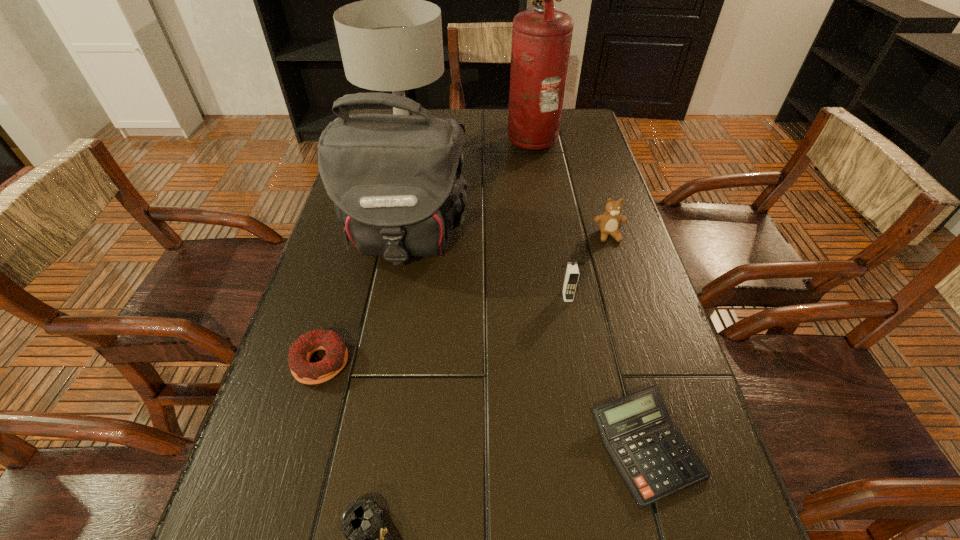
Find the location of a particular element. vacant space that's between the shoulder bag and the sixth farthest object is located at coordinates (363, 300).

Identify the location of free space between the shoulder bag and the fourth tallest object. (486, 267).

The width and height of the screenshot is (960, 540). I want to click on vacant space in between the calculator and the shoulder bag, so tap(524, 342).

You are a GUI agent. You are given a task and a screenshot of the screen. Output one action in this format:
    pyautogui.click(x=<x>, y=<y>)
    Task: Click on the free space between the lampshade and the calculator
    The width and height of the screenshot is (960, 540).
    Given the screenshot: What is the action you would take?
    pyautogui.click(x=525, y=296)

Image resolution: width=960 pixels, height=540 pixels. Find the location of `free space between the lampshade and the fifth tallest object`. free space between the lampshade and the fifth tallest object is located at coordinates (507, 190).

Locate an element on the screen. This screenshot has width=960, height=540. free space that is in between the sixth farthest object and the fourth shortest object is located at coordinates (465, 299).

Choose which object is the fourth nearest neighbor to the doughnut. Please provide its 2D coordinates. Your answer should be formatted as a tuple, i.e. [(x, y)], where the tuple contains the x and y coordinates of a point satisfying the conditions above.

[(572, 273)]

Point out which object is positioned as the fifth nearest to the teddy bear. Please provide its 2D coordinates. Your answer should be formatted as a tuple, i.e. [(x, y)], where the tuple contains the x and y coordinates of a point satisfying the conditions above.

[(392, 40)]

Find the location of a particular element. The height and width of the screenshot is (540, 960). vacant region that satisfies the following two spatial constraints: 1. on the open flap of the calculator; 2. on the right side of the shoulder bag is located at coordinates (367, 447).

The height and width of the screenshot is (540, 960). What are the coordinates of `vacant space that satisfies the following two spatial constraints: 1. on the front-facing side of the calculator; 2. on the left side of the fifth shortest object` in the screenshot? It's located at (595, 447).